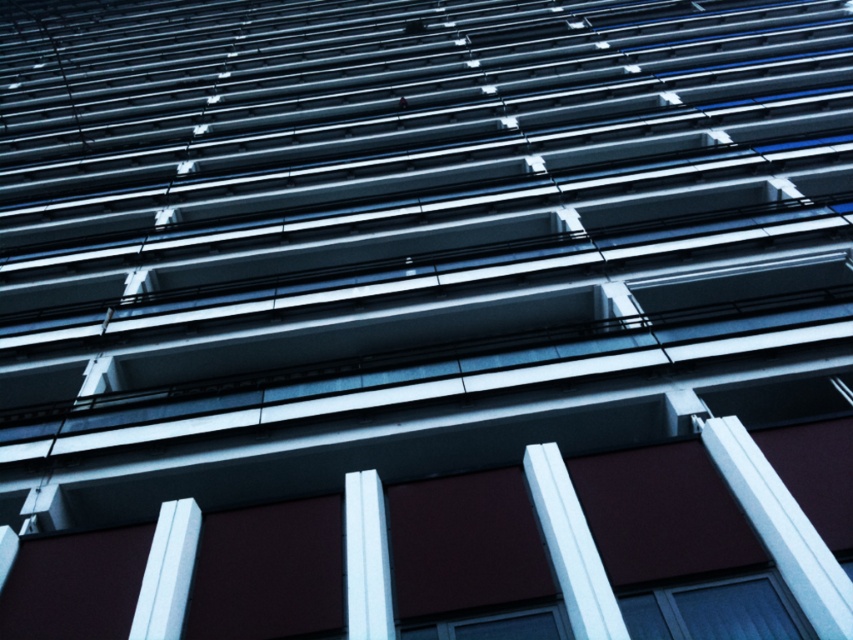
Question: Among these objects, which one is nearest to the camera?

Choices:
 (A) white smooth pillar at lower center
 (B) white glossy pillar at center

Answer: (A)

Question: Which of the following is the closest to the observer?

Choices:
 (A) white smooth pillar at lower center
 (B) white glossy pillar at center

Answer: (A)

Question: Which of the following is the closest to the observer?

Choices:
 (A) (376, 477)
 (B) (563, 465)

Answer: (B)

Question: Is white smooth pillar at lower center positioned in front of white glossy pillar at center?

Choices:
 (A) no
 (B) yes

Answer: (B)

Question: Does white smooth pillar at lower center appear under white glossy pillar at center?

Choices:
 (A) no
 (B) yes

Answer: (A)

Question: Can you confirm if white smooth pillar at lower center is smaller than white glossy pillar at center?

Choices:
 (A) yes
 (B) no

Answer: (B)